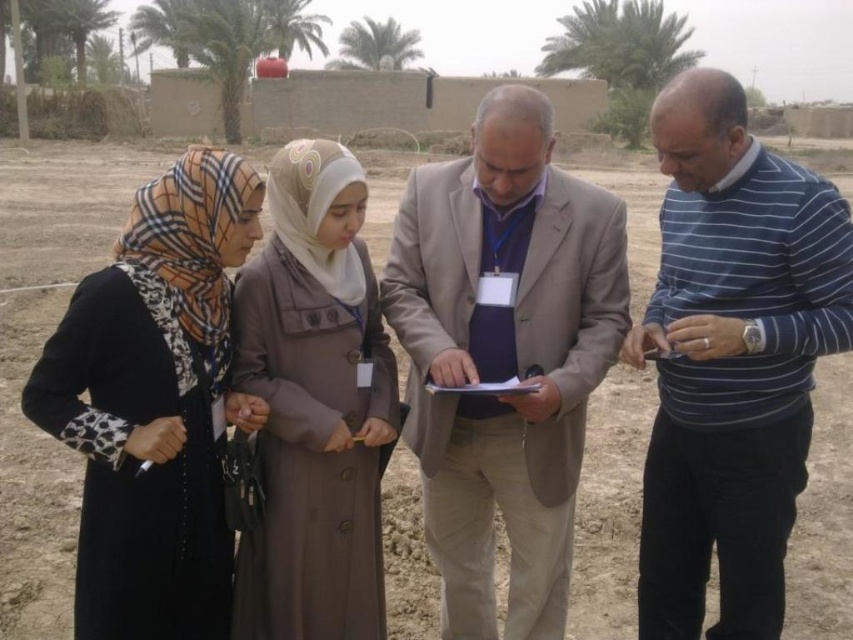
Question: From the image, what is the correct spatial relationship of beige fabric suit at center in relation to matte brown coat at center?

Choices:
 (A) above
 (B) below

Answer: (B)

Question: Which object is closer to the camera taking this photo?

Choices:
 (A) black fabric hijab at left
 (B) beige fabric suit at center
 (C) blue striped sweater at center

Answer: (A)

Question: Which object is the farthest from the black fabric hijab at left?

Choices:
 (A) matte brown coat at center
 (B) blue striped sweater at center
 (C) beige fabric suit at center

Answer: (B)

Question: Does beige fabric suit at center appear on the right side of black fabric hijab at left?

Choices:
 (A) no
 (B) yes

Answer: (B)

Question: Which of these objects is positioned closest to the blue striped sweater at center?

Choices:
 (A) black fabric hijab at left
 (B) beige fabric suit at center

Answer: (B)

Question: Can you confirm if blue striped sweater at center is positioned to the left of matte brown coat at center?

Choices:
 (A) no
 (B) yes

Answer: (A)